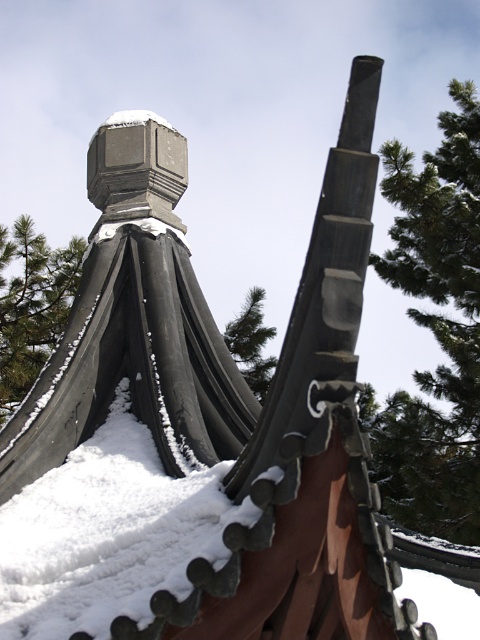
Question: Is green textured pine tree at upper right to the right of green textured pine tree at center from the viewer's perspective?

Choices:
 (A) yes
 (B) no

Answer: (A)

Question: Which of the following is the farthest from the observer?

Choices:
 (A) green textured pine tree at upper left
 (B) green textured pine tree at upper right

Answer: (A)

Question: Does green textured pine tree at upper left appear on the left side of green textured pine tree at center?

Choices:
 (A) no
 (B) yes

Answer: (B)

Question: Is green textured pine tree at upper right further to camera compared to green textured pine tree at upper left?

Choices:
 (A) no
 (B) yes

Answer: (A)

Question: Considering the real-world distances, which object is closest to the green textured pine tree at center?

Choices:
 (A) green textured pine tree at upper left
 (B) green textured pine tree at upper right

Answer: (B)

Question: Which of these objects is positioned farthest from the green textured pine tree at center?

Choices:
 (A) green textured pine tree at upper right
 (B) green textured pine tree at upper left

Answer: (B)